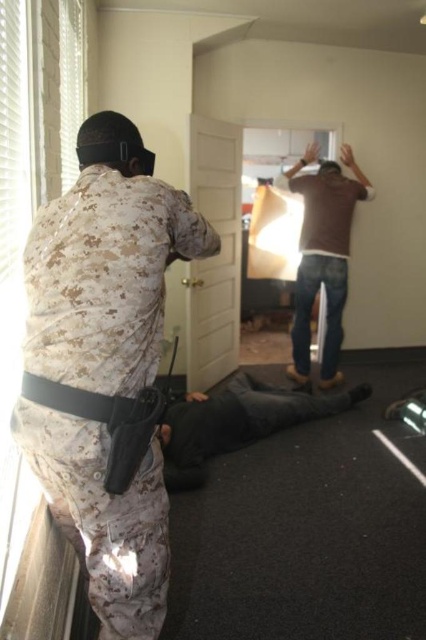
You are a drone operator trying to locate two points in a room. You need to determine which point is closer to your camera. The points are labeled as point (x=305, y=305) and point (x=345, y=403). Based on the scene description, which point is closer to the camera?

Point (x=305, y=305) is closer to the camera than point (x=345, y=403) because it is further to the viewer.

You are an interior designer assessing the room. You notice two items made of camouflage fabric. The first is the camouflagetextured fabric at left, and the second is the camouflage fabric uniform at center. Which of these two items is larger in size?

The camouflage fabric uniform at center is larger than the camouflagetextured fabric at left.

You are a security guard in the room. You see the camouflagetextured fabric at left. Can you reach it from your current position without moving your feet?

The camouflagetextured fabric at left is 3.85 feet away. Since the average person can reach about 2.5 feet without moving their feet, you cannot reach it without moving.